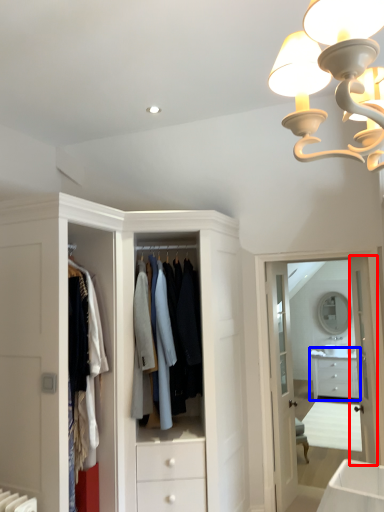
Question: Which point is further to the camera, door (highlighted by a red box) or chest of drawers (highlighted by a blue box)?

Choices:
 (A) door
 (B) chest of drawers

Answer: (B)